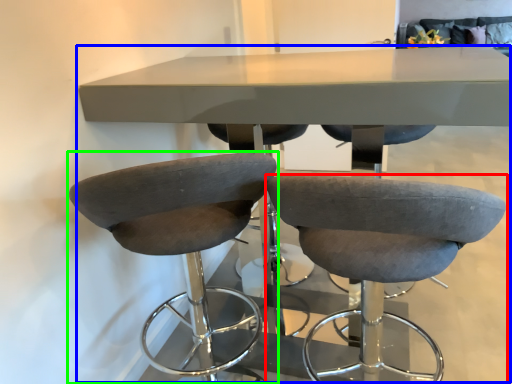
Question: Considering the real-world distances, which object is closest to chair (highlighted by a red box)? table (highlighted by a blue box) or chair (highlighted by a green box).

Choices:
 (A) table
 (B) chair

Answer: (B)